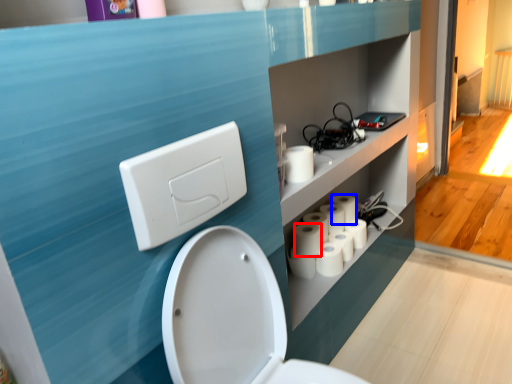
Question: Among these objects, which one is farthest to the camera, toilet paper (highlighted by a red box) or toilet paper (highlighted by a blue box)?

Choices:
 (A) toilet paper
 (B) toilet paper

Answer: (B)